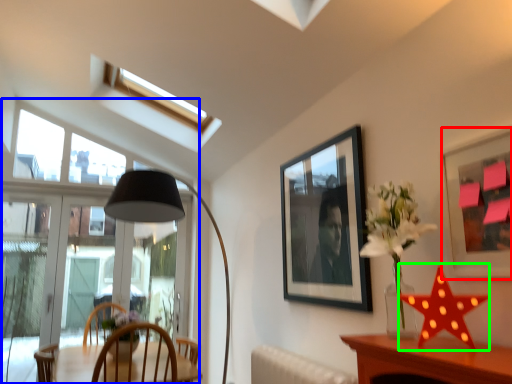
Question: Which object is positioned farthest from picture frame (highlighted by a red box)? Select from window (highlighted by a blue box) and star (highlighted by a green box).

Choices:
 (A) window
 (B) star

Answer: (A)